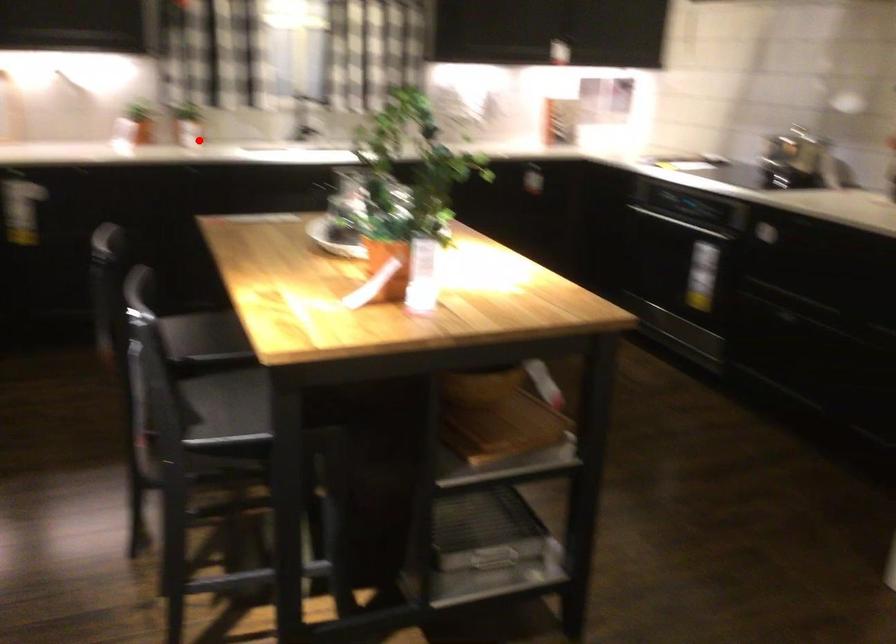
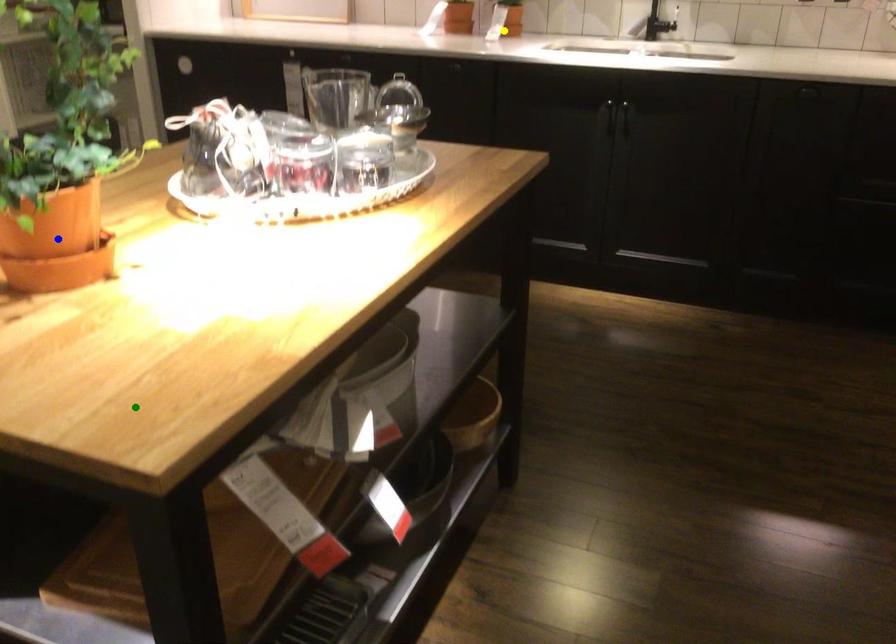
Question: I am providing you with two images of the same scene from different viewpoints. A red point is marked on the first image. You are given multiple points on the second image. Can you choose the point in image 2 that corresponds to the point in image 1?

Choices:
 (A) blue point
 (B) green point
 (C) yellow point

Answer: (C)